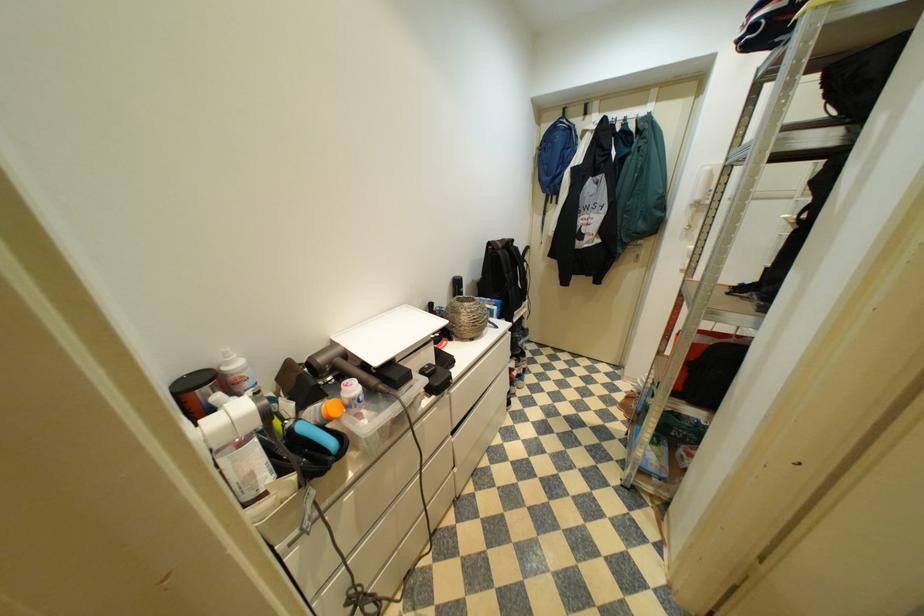
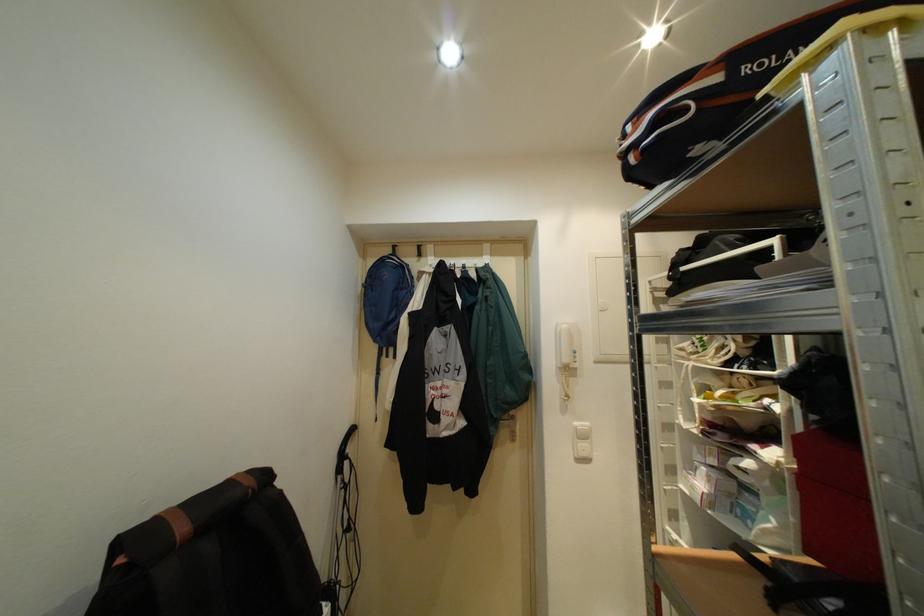
Locate, in the second image, the point that corresponds to [544,128] in the first image.

(370, 262)